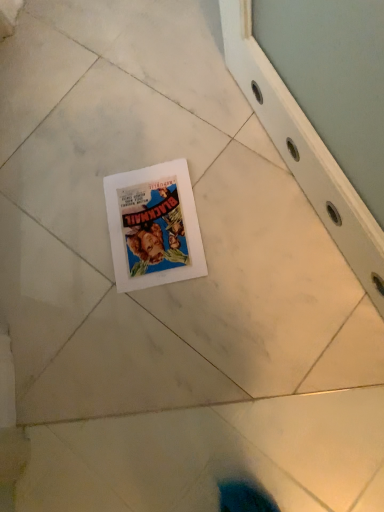
At what (x,y) coordinates should I click in order to perform the action: click on matte paper comic book at center. Please return your answer as a coordinate pair (x, y). This screenshot has height=512, width=384. Looking at the image, I should click on (153, 226).

Measure the distance between matte paper comic book at center and camera.

The distance of matte paper comic book at center from camera is 36.77 inches.

This screenshot has height=512, width=384. What do you see at coordinates (153, 226) in the screenshot?
I see `matte paper comic book at center` at bounding box center [153, 226].

At what (x,y) coordinates should I click in order to perform the action: click on matte paper comic book at center. Please return your answer as a coordinate pair (x, y). Image resolution: width=384 pixels, height=512 pixels. Looking at the image, I should click on (153, 226).